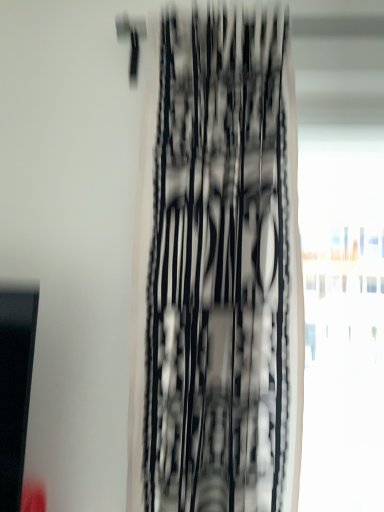
Question: Does transparent glass window at right appear on the right side of black mesh curtain at center?

Choices:
 (A) yes
 (B) no

Answer: (A)

Question: Are transparent glass window at right and black mesh curtain at center far apart?

Choices:
 (A) no
 (B) yes

Answer: (B)

Question: Can you confirm if transparent glass window at right is positioned to the left of black mesh curtain at center?

Choices:
 (A) no
 (B) yes

Answer: (A)

Question: Could you tell me if transparent glass window at right is turned towards black mesh curtain at center?

Choices:
 (A) no
 (B) yes

Answer: (A)

Question: Is transparent glass window at right thinner than black mesh curtain at center?

Choices:
 (A) no
 (B) yes

Answer: (B)

Question: Can you confirm if transparent glass window at right is taller than black mesh curtain at center?

Choices:
 (A) no
 (B) yes

Answer: (A)

Question: From a real-world perspective, is black mesh curtain at center located beneath transparent glass window at right?

Choices:
 (A) yes
 (B) no

Answer: (B)

Question: Is black mesh curtain at center turned away from transparent glass window at right?

Choices:
 (A) yes
 (B) no

Answer: (B)

Question: Considering the relative sizes of black mesh curtain at center and transparent glass window at right in the image provided, is black mesh curtain at center wider than transparent glass window at right?

Choices:
 (A) no
 (B) yes

Answer: (B)

Question: Is transparent glass window at right inside black mesh curtain at center?

Choices:
 (A) yes
 (B) no

Answer: (B)

Question: Does black mesh curtain at center turn towards transparent glass window at right?

Choices:
 (A) yes
 (B) no

Answer: (B)

Question: Is black mesh curtain at center closer to camera compared to transparent glass window at right?

Choices:
 (A) yes
 (B) no

Answer: (A)

Question: Visually, is transparent glass window at right positioned to the left or to the right of black mesh curtain at center?

Choices:
 (A) right
 (B) left

Answer: (A)